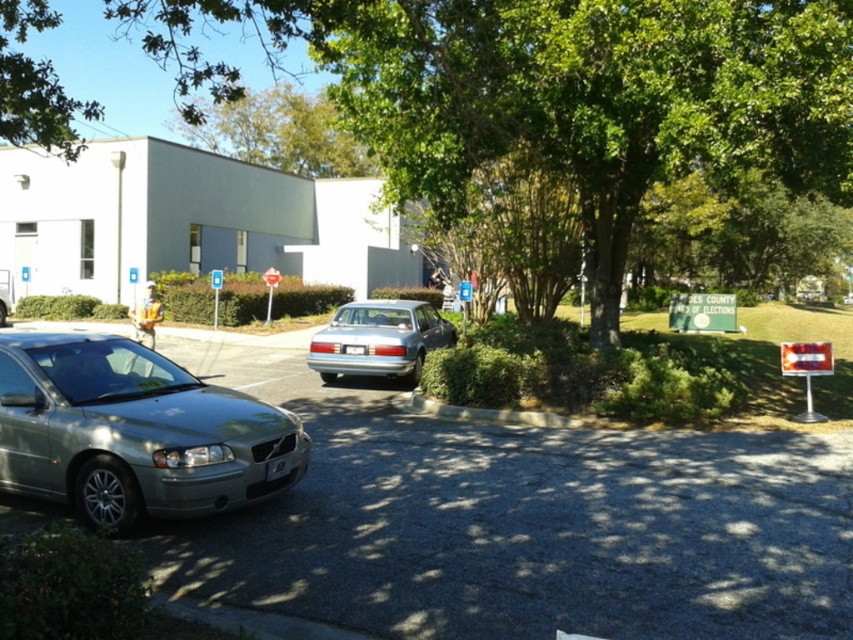
Question: Does satin silver car at lower left appear under silver metallic sedan at center?

Choices:
 (A) no
 (B) yes

Answer: (B)

Question: Which of the following is the closest to the observer?

Choices:
 (A) satin silver car at lower left
 (B) silver metallic car at lower left
 (C) green leafy tree at upper center
 (D) silver metallic sedan at center

Answer: (B)

Question: Is green leafy tree at upper center thinner than satin silver sedan at center?

Choices:
 (A) no
 (B) yes

Answer: (A)

Question: Estimate the real-world distances between objects in this image. Which object is closer to the silver metallic sedan at center?

Choices:
 (A) satin silver car at lower left
 (B) green leafy tree at upper center

Answer: (B)

Question: Which point is farther to the camera?

Choices:
 (A) (280, 483)
 (B) (344, 131)
 (C) (706, 86)
 (D) (3, 312)

Answer: (D)

Question: In this image, where is satin silver car at lower left located relative to satin silver sedan at center?

Choices:
 (A) left
 (B) right

Answer: (A)